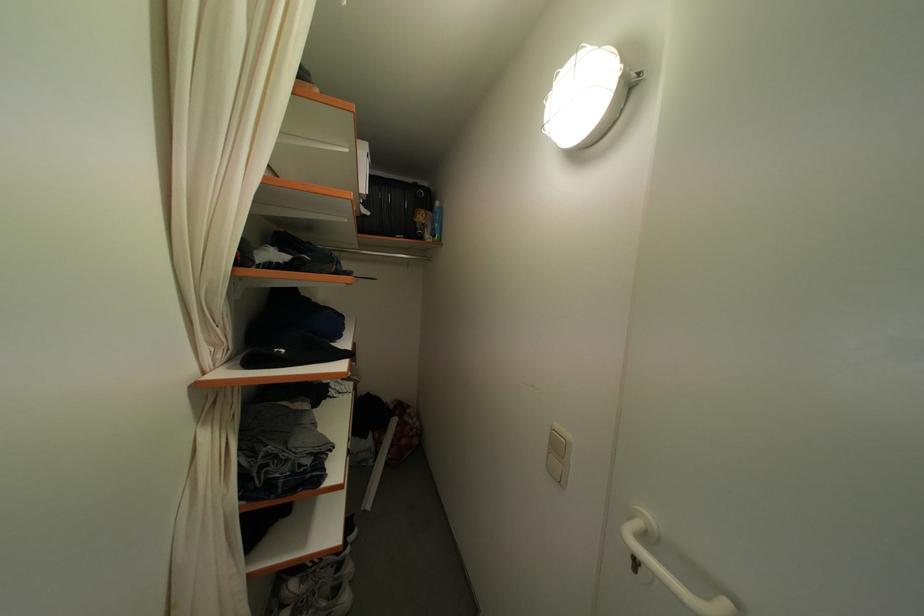
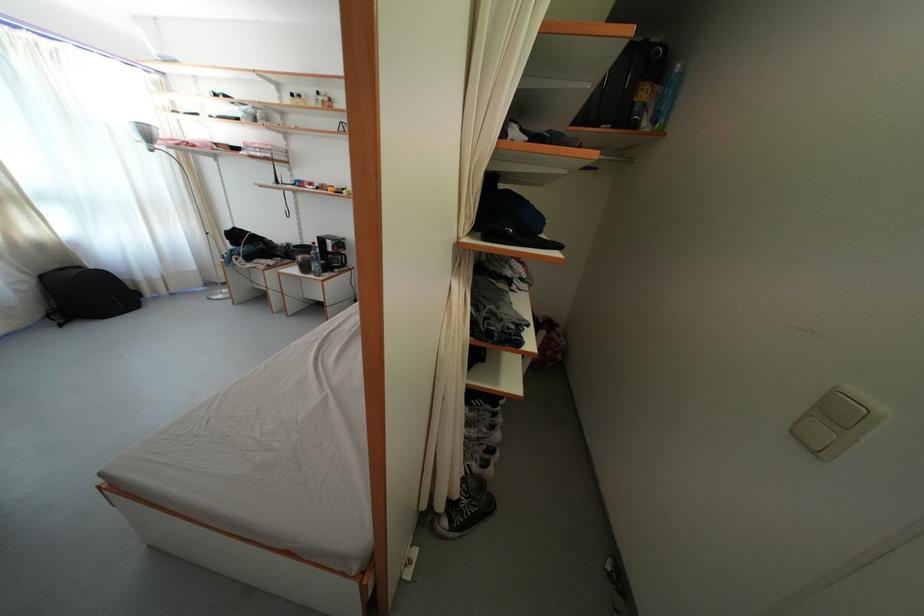
First-person continuous shooting, in which direction is the camera rotating?

The camera's rotation is toward left-down.